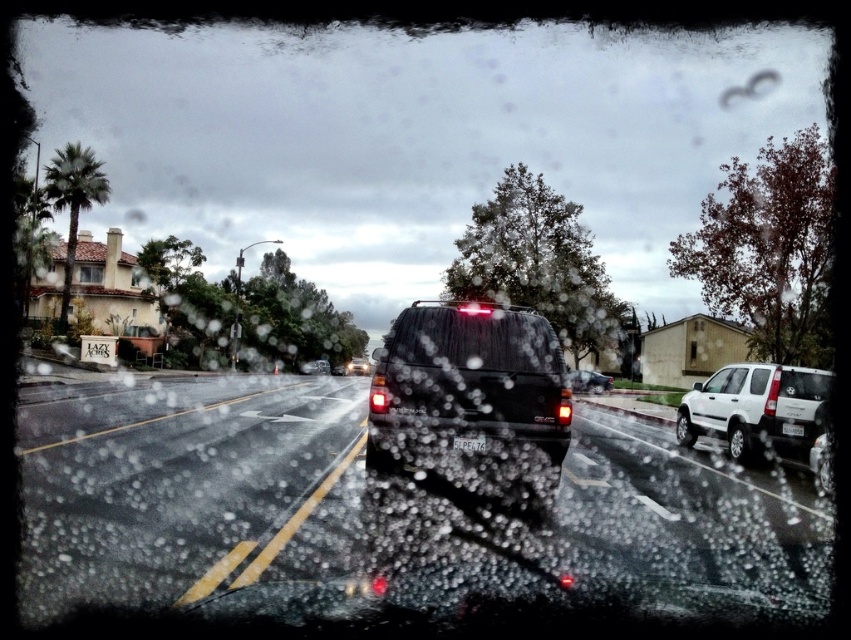
Question: Can you confirm if transparent glass windshield at center is positioned below shiny black suv at center?

Choices:
 (A) no
 (B) yes

Answer: (A)

Question: Observing the image, what is the correct spatial positioning of transparent glass windshield at center in reference to shiny black suv at center?

Choices:
 (A) left
 (B) right

Answer: (B)

Question: Which of the following is the farthest from the observer?

Choices:
 (A) (469, 333)
 (B) (426, 348)

Answer: (A)

Question: Estimate the real-world distances between objects in this image. Which object is farther from the white matte suv at right?

Choices:
 (A) metallic silver suv at center
 (B) shiny black suv at center

Answer: (B)

Question: Observing the image, what is the correct spatial positioning of shiny black suv at center in reference to white plastic license plate at center?

Choices:
 (A) right
 (B) left

Answer: (B)

Question: Which object is farther from the camera taking this photo?

Choices:
 (A) matte black suv at center
 (B) shiny black suv at center

Answer: (B)